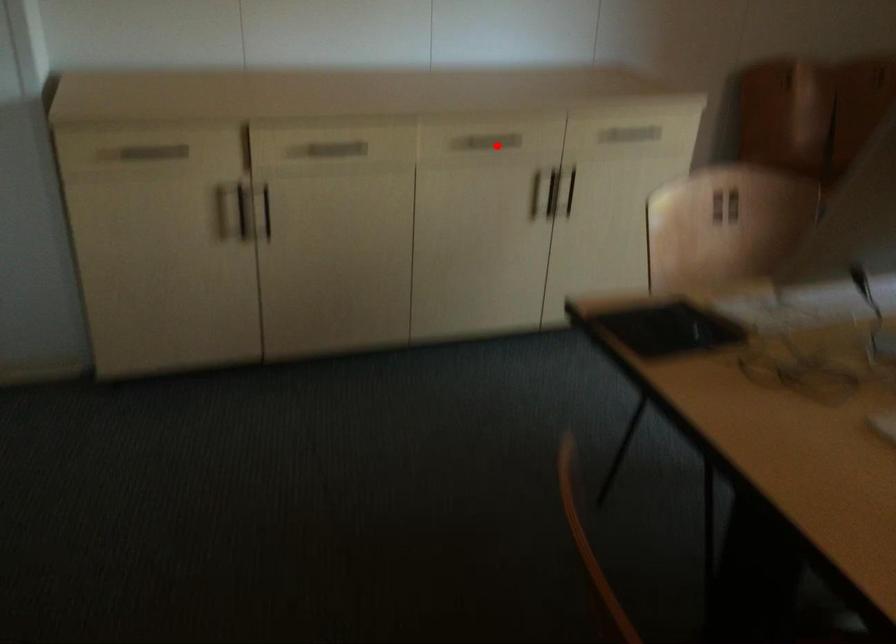
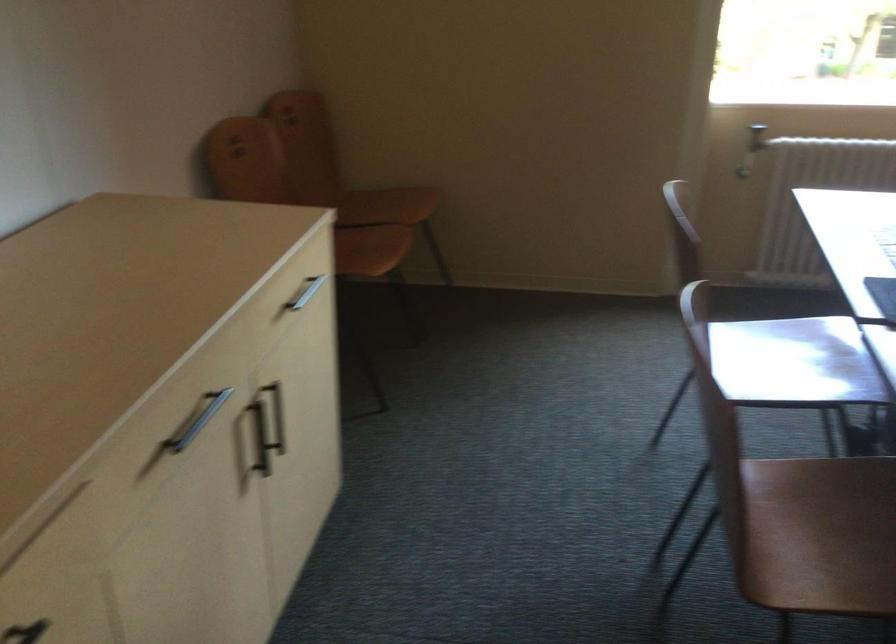
Question: I am providing you with two images of the same scene from different viewpoints. Image1 has a red point marked. In image2, the corresponding 3D location appears at what relative position? Reply with the corresponding letter.

Choices:
 (A) Closer
 (B) Farther

Answer: (A)